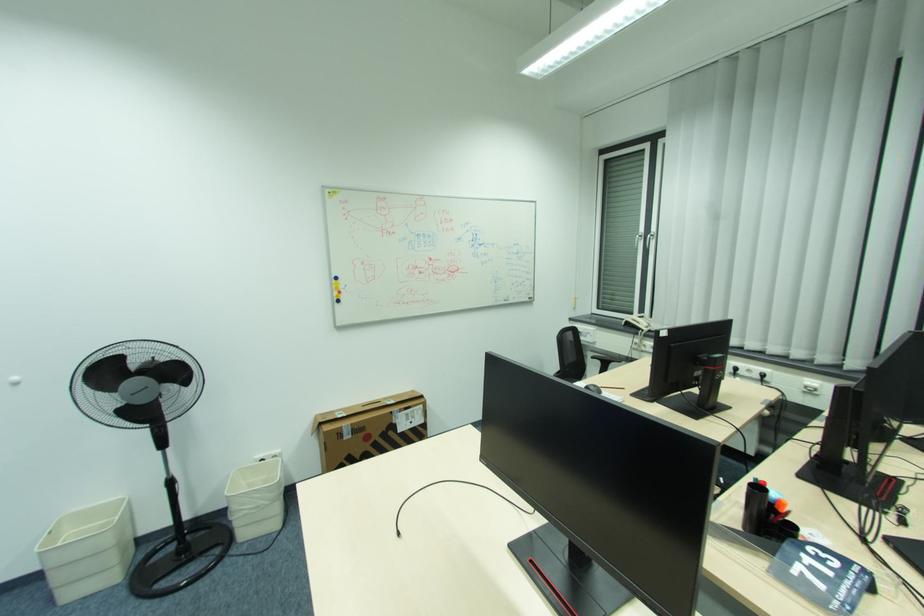
This screenshot has width=924, height=616. In order to click on red power switch in this screenshot , I will do `click(885, 488)`.